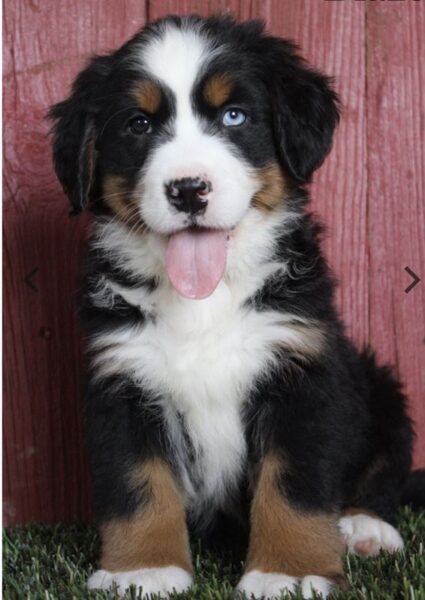
At what (x,y) coordinates should I click in order to perform the action: click on wood panel. Please return your answer as a coordinate pair (x, y). Looking at the image, I should click on [379, 50].